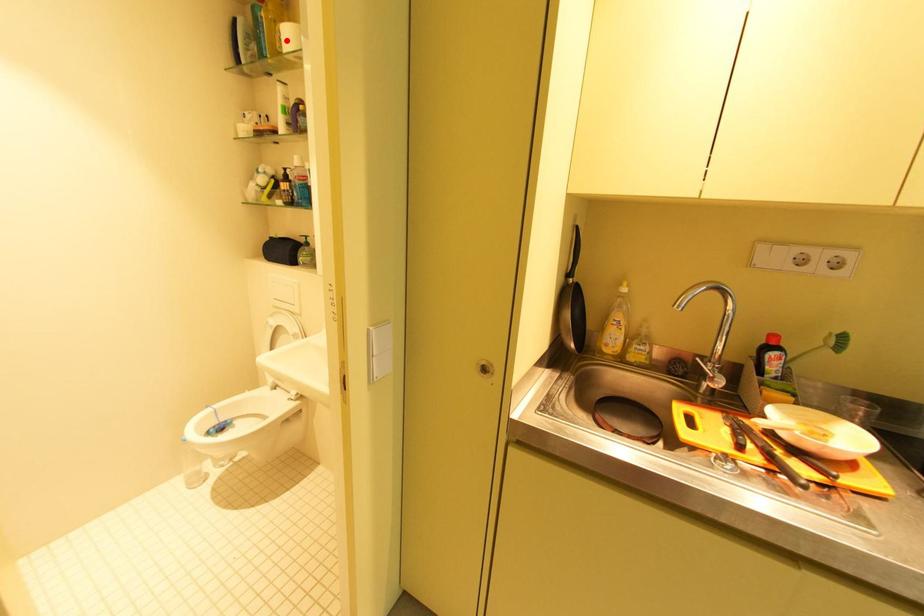
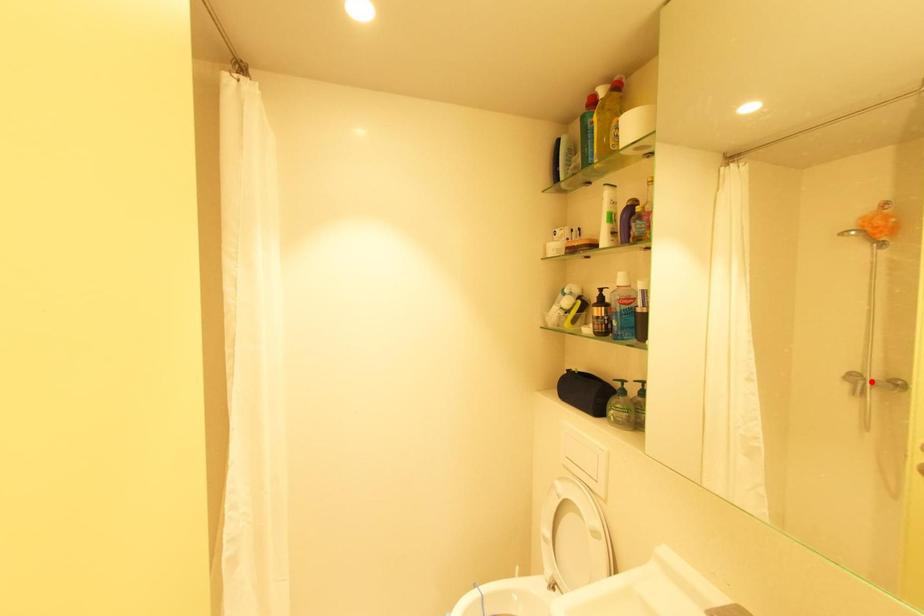
Looking at this image, I am providing you with two images of the same scene from different viewpoints. A red point is marked on the first image and another point is marked on the second image. Are the points marked in image1 and image2 representing the same 3D position?

No